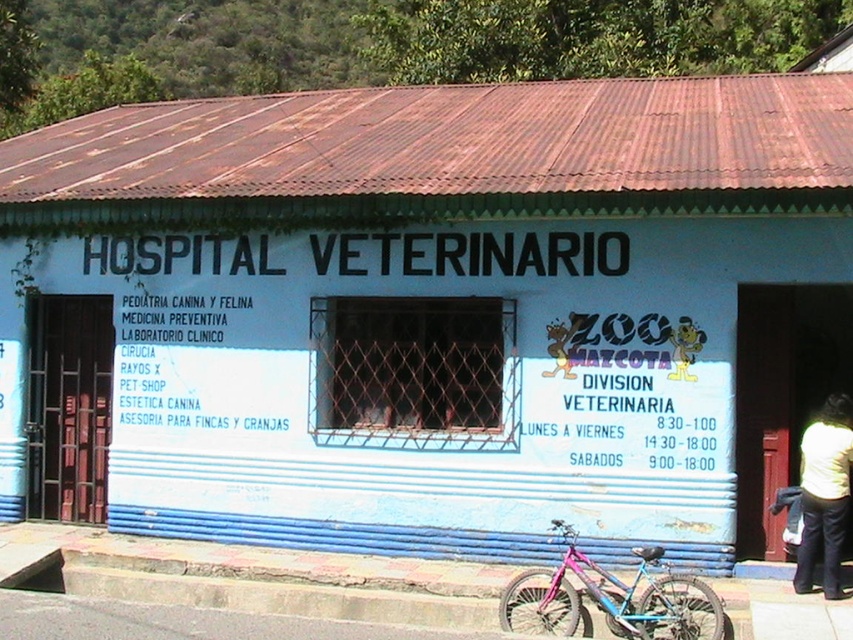
You are a delivery person standing at the entrance of Hospital Veterinario. You need to park your pink metallic bicycle at lower center in a spot that is exactly 10 meters away from the clinic entrance. Is the bicycle currently positioned at the correct distance?

The pink metallic bicycle at lower center is 8.80 meters away from viewer, so it is not positioned at the correct distance of 10 meters from the clinic entrance.

You are standing in front of the veterinary clinic and want to park your pink metallic bicycle at lower center. The clinic has a designated parking spot at coordinates 0.934, 0.716. Can you determine if your bicycle will fit in the parking spot?

The pink metallic bicycle at lower center is located exactly at the designated parking spot coordinates (610, 596), so it will fit perfectly.